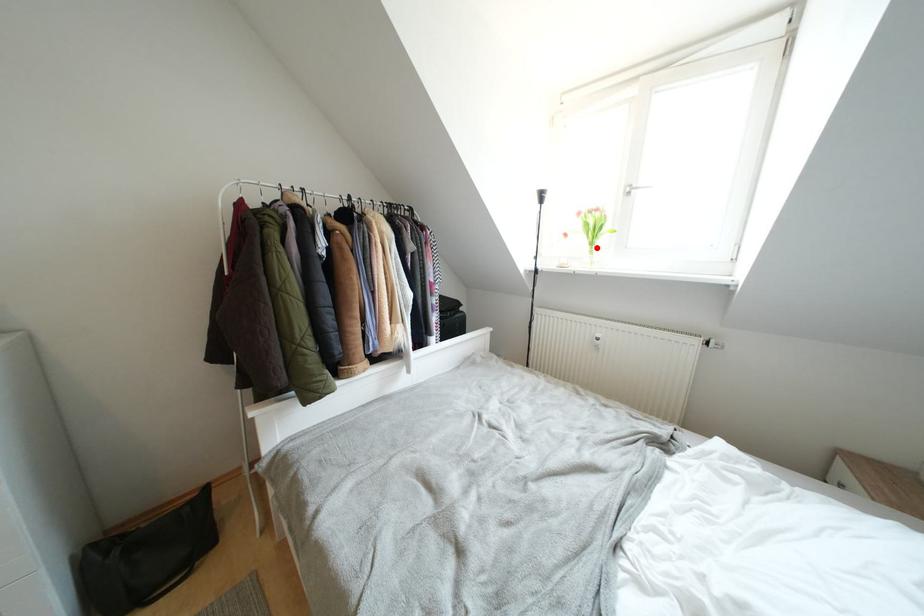
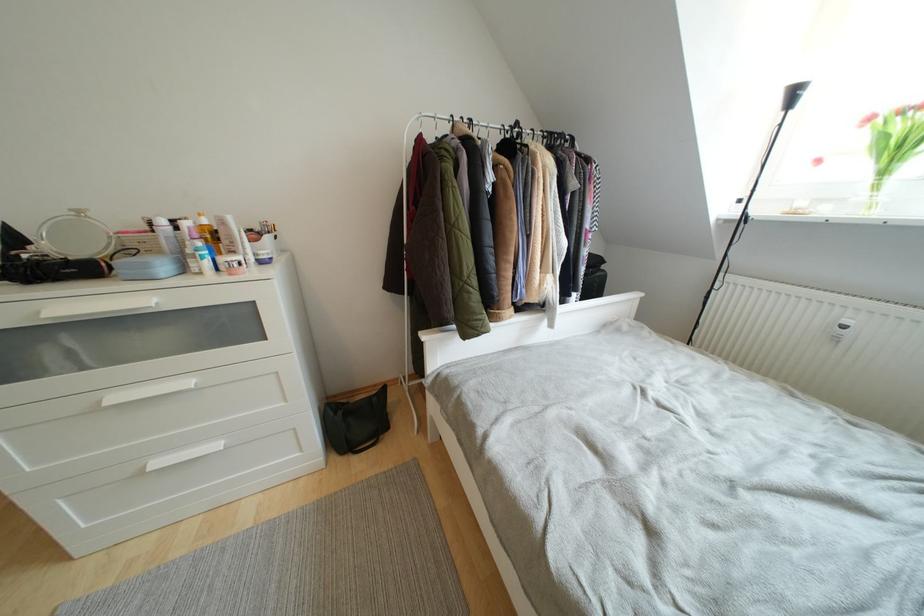
Locate, in the second image, the point that corresponds to the highlighted location in the first image.

(890, 176)